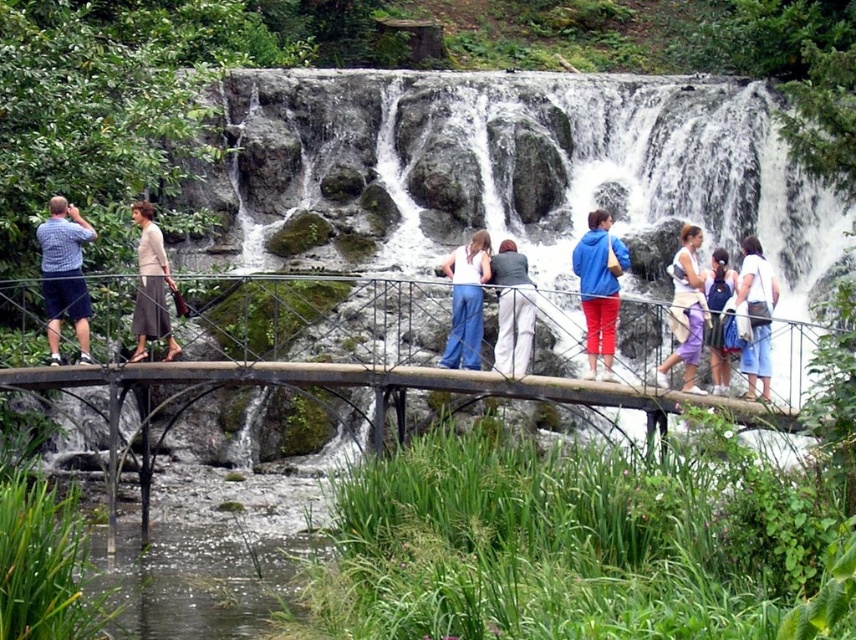
Which is behind, point (571, 378) or point (741, 358)?

The point (571, 378) is more distant.

Identify the location of wooden bridge at center. The width and height of the screenshot is (856, 640). (361, 360).

Locate an element on the screen. The image size is (856, 640). wooden bridge at center is located at coordinates (361, 360).

Which is more to the left, blue matte jacket at center or white cotton shirt at center?

blue matte jacket at center

Who is taller, blue matte jacket at center or white cotton shirt at center?

white cotton shirt at center

Between point (586, 276) and point (742, 275), which one is positioned in front?

Point (742, 275)

Identify the location of blue matte jacket at center. (599, 288).

Is white cotton tank top at center shorter than white cotton shirt at center?

Correct, white cotton tank top at center is not as tall as white cotton shirt at center.

Between white cotton tank top at center and white cotton shirt at center, which one is positioned lower?

white cotton tank top at center is lower down.

Which is in front, point (479, 260) or point (742, 365)?

Positioned in front is point (742, 365).

Find the location of a particular element. The image size is (856, 640). white cotton tank top at center is located at coordinates (467, 301).